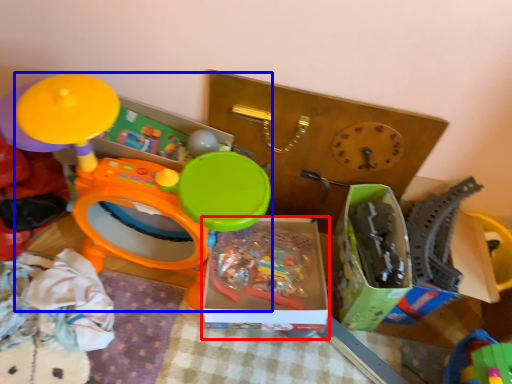
Question: Which point is further to the camera, storage box (highlighted by a red box) or toy (highlighted by a blue box)?

Choices:
 (A) storage box
 (B) toy

Answer: (A)